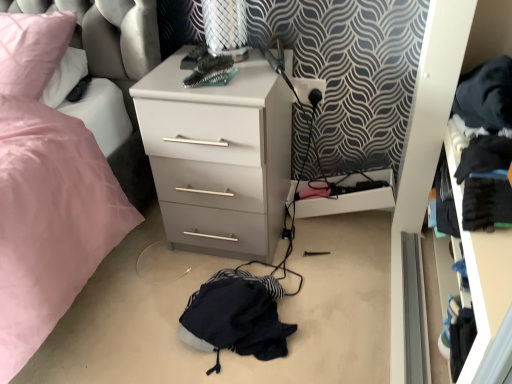
Find the location of a particular element. The image size is (512, 384). white plastic drawer at lower center is located at coordinates (352, 199).

What do you see at coordinates (104, 60) in the screenshot?
I see `pink fabric swivel chair at upper left` at bounding box center [104, 60].

This screenshot has width=512, height=384. Identify the location of pink fabric swivel chair at upper left. click(x=104, y=60).

Identify the location of dark blue fabric at center. This screenshot has width=512, height=384. (236, 317).

Locate an element on the screen. The image size is (512, 384). black fabric drawer at right is located at coordinates (432, 161).

Locate an element on the screen. Image resolution: width=512 pixels, height=384 pixels. matte gray chest of drawers at center is located at coordinates (218, 157).

Where is `white plastic drawer at lower center`? white plastic drawer at lower center is located at coordinates (352, 199).

Between matte gray chest of drawers at center and black fabric drawer at right, which one is positioned in front?

black fabric drawer at right is more forward.

In terms of width, does matte gray chest of drawers at center look wider or thinner when compared to black fabric drawer at right?

In the image, matte gray chest of drawers at center appears to be wider than black fabric drawer at right.

Considering the relative sizes of matte gray chest of drawers at center and black fabric drawer at right in the image provided, is matte gray chest of drawers at center bigger than black fabric drawer at right?

Correct, matte gray chest of drawers at center is larger in size than black fabric drawer at right.

Does point (322, 88) appear closer or farther from the camera than point (261, 305)?

Point (322, 88).

Does black plastic electric outlet at upper right appear on the left side of dark blue fabric at center?

In fact, black plastic electric outlet at upper right is to the right of dark blue fabric at center.

From a real-world perspective, does black plastic electric outlet at upper right stand above dark blue fabric at center?

Indeed, from a real-world perspective, black plastic electric outlet at upper right stands above dark blue fabric at center.

From the image's perspective, is white plastic drawer at lower center beneath pink fabric swivel chair at upper left?

Yes, from the image's perspective, white plastic drawer at lower center is below pink fabric swivel chair at upper left.

Is white plastic drawer at lower center far from pink fabric swivel chair at upper left?

No, white plastic drawer at lower center is in close proximity to pink fabric swivel chair at upper left.

Considering the relative sizes of white plastic drawer at lower center and pink fabric swivel chair at upper left in the image provided, is white plastic drawer at lower center shorter than pink fabric swivel chair at upper left?

Correct, white plastic drawer at lower center is not as tall as pink fabric swivel chair at upper left.

Can you confirm if white plastic drawer at lower center is thinner than pink fabric swivel chair at upper left?

Indeed, white plastic drawer at lower center has a lesser width compared to pink fabric swivel chair at upper left.

How much distance is there between black plastic electric outlet at upper right and pink fabric swivel chair at upper left?

black plastic electric outlet at upper right and pink fabric swivel chair at upper left are 25.39 inches apart from each other.

Consider the image. Is black plastic electric outlet at upper right looking in the opposite direction of pink fabric swivel chair at upper left?

No, pink fabric swivel chair at upper left is not at the back of black plastic electric outlet at upper right.

Locate an element on the screen. The image size is (512, 384). electric outlet below the pink fabric swivel chair at upper left (from a real-world perspective) is located at coordinates (308, 88).

Looking at this image, does black plastic electric outlet at upper right have a smaller size compared to pink fabric swivel chair at upper left?

Yes, black plastic electric outlet at upper right is smaller than pink fabric swivel chair at upper left.

From the picture: Is dark blue fabric at center surrounded by pink fabric swivel chair at upper left?

No, dark blue fabric at center is not a part of pink fabric swivel chair at upper left.

From a real-world perspective, which is physically above, pink fabric swivel chair at upper left or dark blue fabric at center?

In real-world perspective, pink fabric swivel chair at upper left is above.

From the image's perspective, between pink fabric swivel chair at upper left and dark blue fabric at center, which one is located above?

pink fabric swivel chair at upper left.

Could you tell me if pink fabric swivel chair at upper left is facing dark blue fabric at center?

No.

Is pink fabric swivel chair at upper left aimed at black fabric drawer at right?

No, pink fabric swivel chair at upper left is not aimed at black fabric drawer at right.

Is pink fabric swivel chair at upper left outside of black fabric drawer at right?

pink fabric swivel chair at upper left is positioned outside black fabric drawer at right.

Looking at their sizes, would you say pink fabric swivel chair at upper left is wider or thinner than black fabric drawer at right?

Considering their sizes, pink fabric swivel chair at upper left looks broader than black fabric drawer at right.

From the image's perspective, would you say dark blue fabric at center is shown under white plastic drawer at lower center?

Correct, dark blue fabric at center appears lower than white plastic drawer at lower center in the image.

Which object is wider, dark blue fabric at center or white plastic drawer at lower center?

dark blue fabric at center.

Looking at this image, from a real-world perspective, which is physically below, dark blue fabric at center or white plastic drawer at lower center?

dark blue fabric at center, from a real-world perspective.

What's the angular difference between dark blue fabric at center and white plastic drawer at lower center's facing directions?

There is a 0.000147-degree angle between the facing directions of dark blue fabric at center and white plastic drawer at lower center.

The height and width of the screenshot is (384, 512). In order to click on dresser below the matte gray chest of drawers at center (from the image's perspective) in this screenshot , I will do `click(432, 161)`.

Where is `clothing located underneath the black plastic electric outlet at upper right (from a real-world perspective)`? The width and height of the screenshot is (512, 384). clothing located underneath the black plastic electric outlet at upper right (from a real-world perspective) is located at coordinates pyautogui.click(x=236, y=317).

Based on their spatial positions, is black fabric drawer at right or pink fabric swivel chair at upper left further from dark blue fabric at center?

Among the two, pink fabric swivel chair at upper left is located further to dark blue fabric at center.

Considering their positions, is matte gray chest of drawers at center positioned further to pink fabric swivel chair at upper left than black plastic electric outlet at upper right?

black plastic electric outlet at upper right is further to pink fabric swivel chair at upper left.

Considering their positions, is dark blue fabric at center positioned closer to white plastic drawer at lower center than black plastic electric outlet at upper right?

Among the two, black plastic electric outlet at upper right is located nearer to white plastic drawer at lower center.

Consider the image. Based on their spatial positions, is white plastic drawer at lower center or black fabric drawer at right closer to matte gray chest of drawers at center?

white plastic drawer at lower center is closer to matte gray chest of drawers at center.

Looking at the image, which one is located further to black fabric drawer at right, black plastic electric outlet at upper right or white plastic drawer at lower center?

black plastic electric outlet at upper right lies further to black fabric drawer at right than the other object.

Based on their spatial positions, is black plastic electric outlet at upper right or white plastic drawer at lower center further from matte gray chest of drawers at center?

Among the two, white plastic drawer at lower center is located further to matte gray chest of drawers at center.

Looking at this image, when comparing their distances from black plastic electric outlet at upper right, does dark blue fabric at center or matte gray chest of drawers at center seem closer?

Among the two, matte gray chest of drawers at center is located nearer to black plastic electric outlet at upper right.

Based on their spatial positions, is matte gray chest of drawers at center or black fabric drawer at right further from dark blue fabric at center?

black fabric drawer at right is further to dark blue fabric at center.

Image resolution: width=512 pixels, height=384 pixels. In order to click on clothing between pink fabric swivel chair at upper left and black plastic electric outlet at upper right from left to right in this screenshot , I will do `click(236, 317)`.

Identify the location of shelf between matte gray chest of drawers at center and black plastic electric outlet at upper right in the front-back direction. This screenshot has height=384, width=512. (352, 199).

The image size is (512, 384). In order to click on clothing situated between matte gray chest of drawers at center and white plastic drawer at lower center from left to right in this screenshot , I will do [x=236, y=317].

Find the location of `shelf situated between pink fabric swivel chair at upper left and black fabric drawer at right from left to right`. shelf situated between pink fabric swivel chair at upper left and black fabric drawer at right from left to right is located at coordinates (352, 199).